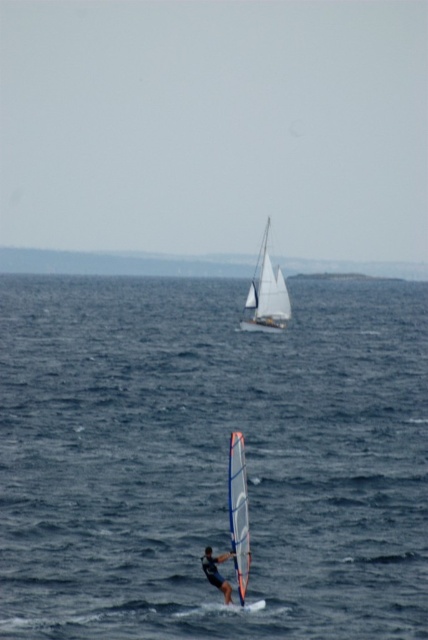
Question: Which point is closer to the camera taking this photo?

Choices:
 (A) (213, 556)
 (B) (261, 410)

Answer: (A)

Question: Can you confirm if white sailboat at center is bigger than dark blue wetsuit at lower center?

Choices:
 (A) yes
 (B) no

Answer: (A)

Question: Observing the image, what is the correct spatial positioning of blue water at center in reference to dark blue wetsuit at lower center?

Choices:
 (A) left
 (B) right

Answer: (A)

Question: Is blue water at center positioned before white sailboat at center?

Choices:
 (A) no
 (B) yes

Answer: (B)

Question: Which point is closer to the camera taking this photo?

Choices:
 (A) (278, 275)
 (B) (95, 596)

Answer: (B)

Question: Which of the following is the closest to the observer?

Choices:
 (A) blue water at center
 (B) dark blue wetsuit at lower center
 (C) white sailboat at center

Answer: (B)